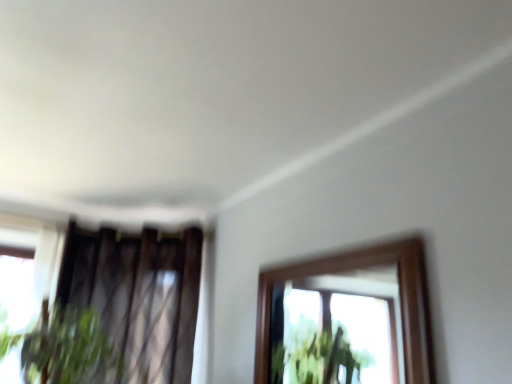
Describe the element at coordinates (138, 296) in the screenshot. The height and width of the screenshot is (384, 512). I see `dark fabric curtain at left` at that location.

At what (x,y) coordinates should I click in order to perform the action: click on dark fabric curtain at left. Please return your answer as a coordinate pair (x, y). Image resolution: width=512 pixels, height=384 pixels. Looking at the image, I should click on (138, 296).

This screenshot has height=384, width=512. I want to click on dark fabric curtain at left, so click(138, 296).